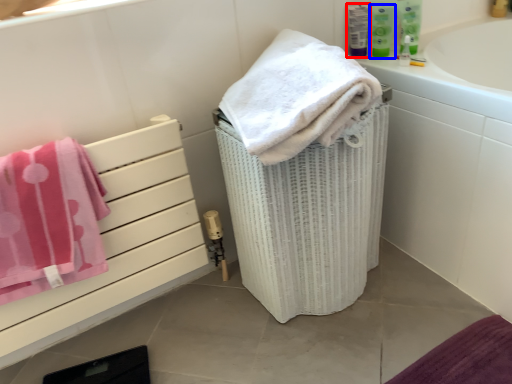
Question: Which point is further to the camera, mouthwash (highlighted by a red box) or mouthwash (highlighted by a blue box)?

Choices:
 (A) mouthwash
 (B) mouthwash

Answer: (A)